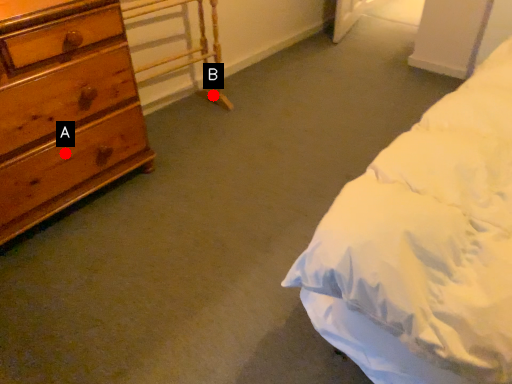
Question: Two points are circled on the image, labeled by A and B beside each circle. Which point is closer to the camera?

Choices:
 (A) A is closer
 (B) B is closer

Answer: (A)